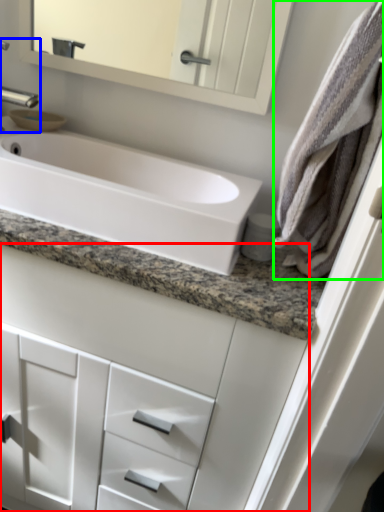
Question: Which object is positioned farthest from bathroom cabinet (highlighted by a red box)? Select from tap (highlighted by a blue box) and bath towel (highlighted by a green box).

Choices:
 (A) tap
 (B) bath towel

Answer: (A)